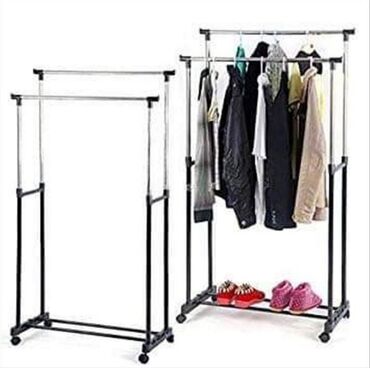
What are the coordinates of `hanger rods` in the screenshot? It's located at (125, 72), (123, 97), (223, 58), (227, 32).